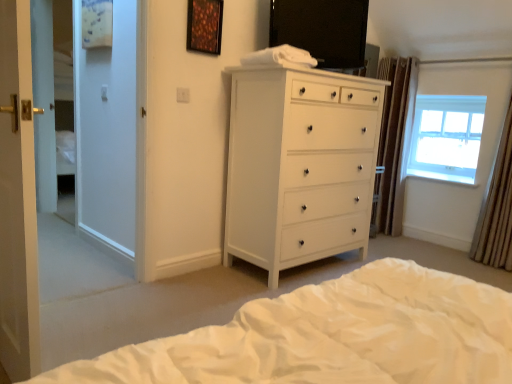
Question: From the image's perspective, is white glossy chest of drawers at center above wooden frame at upper center?

Choices:
 (A) no
 (B) yes

Answer: (A)

Question: Can you confirm if white glossy chest of drawers at center is bigger than wooden frame at upper center?

Choices:
 (A) yes
 (B) no

Answer: (A)

Question: Is white glossy chest of drawers at center smaller than wooden frame at upper center?

Choices:
 (A) yes
 (B) no

Answer: (B)

Question: Considering the relative sizes of white glossy chest of drawers at center and wooden frame at upper center in the image provided, is white glossy chest of drawers at center wider than wooden frame at upper center?

Choices:
 (A) no
 (B) yes

Answer: (B)

Question: Can you confirm if white glossy chest of drawers at center is positioned to the left of wooden frame at upper center?

Choices:
 (A) no
 (B) yes

Answer: (A)

Question: Does white glossy chest of drawers at center have a greater height compared to wooden frame at upper center?

Choices:
 (A) no
 (B) yes

Answer: (B)

Question: Can you confirm if brown textured curtain at right, the 2th curtain viewed from the front, is positioned to the right of white glossy chest of drawers at center?

Choices:
 (A) no
 (B) yes

Answer: (B)

Question: Would you say brown textured curtain at right, the 2th curtain from the right, is outside white glossy chest of drawers at center?

Choices:
 (A) no
 (B) yes

Answer: (B)

Question: Is the surface of brown textured curtain at right, the first curtain viewed from the left, in direct contact with white glossy chest of drawers at center?

Choices:
 (A) yes
 (B) no

Answer: (B)

Question: Is white glossy chest of drawers at center a part of brown textured curtain at right, the 2th curtain from the right?

Choices:
 (A) yes
 (B) no

Answer: (B)

Question: From a real-world perspective, is brown textured curtain at right, the 2th curtain viewed from the front, physically above white glossy chest of drawers at center?

Choices:
 (A) no
 (B) yes

Answer: (B)

Question: Could you tell me if white glossy door at left is facing white soft bed at lower center?

Choices:
 (A) yes
 (B) no

Answer: (A)